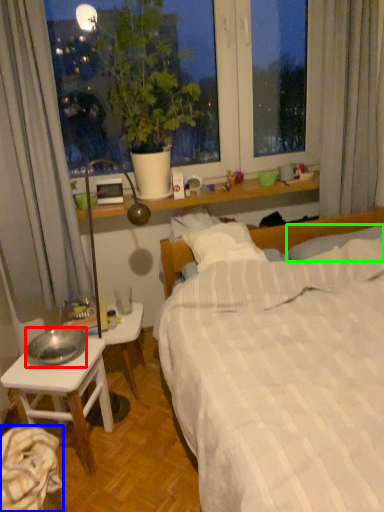
Question: Estimate the real-world distances between objects in this image. Which object is farther from bowl (highlighted by a red box), sheet (highlighted by a blue box) or pillow (highlighted by a green box)?

Choices:
 (A) sheet
 (B) pillow

Answer: (B)